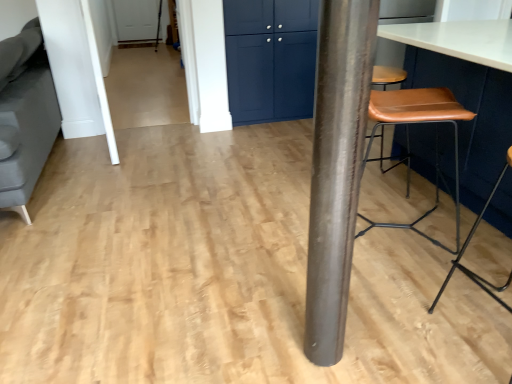
Where is `vacant space that is to the left of brown leather stool at right`? vacant space that is to the left of brown leather stool at right is located at coordinates (395, 326).